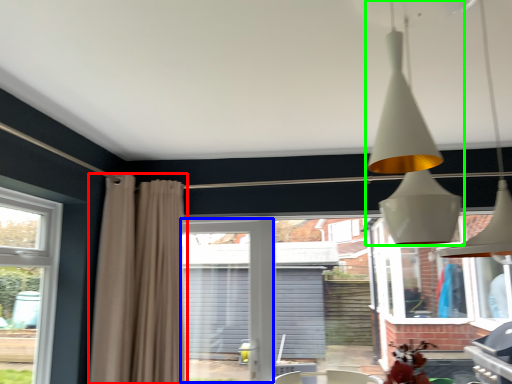
Question: Which is nearer to the curtain (highlighted by a red box)? screen door (highlighted by a blue box) or lamp (highlighted by a green box).

Choices:
 (A) screen door
 (B) lamp

Answer: (A)